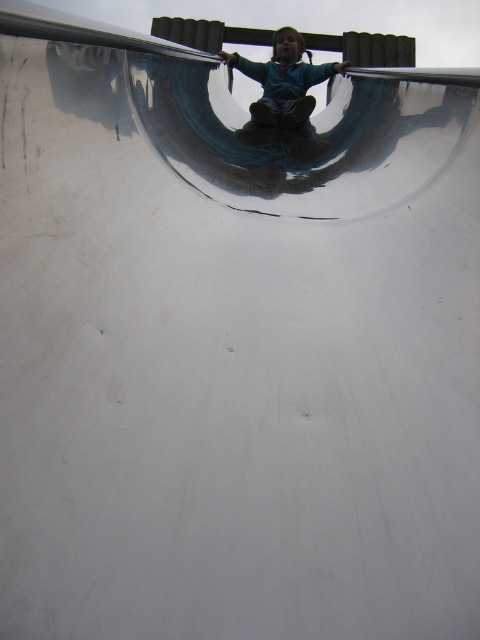
Question: Which point is closer to the camera?

Choices:
 (A) shiny blue skateboard at upper center
 (B) blue matte jacket at upper center

Answer: (A)

Question: Can you confirm if blue matte jacket at upper center is thinner than shiny blue skateboard at upper center?

Choices:
 (A) no
 (B) yes

Answer: (A)

Question: Can you confirm if blue matte jacket at upper center is smaller than shiny blue skateboard at upper center?

Choices:
 (A) no
 (B) yes

Answer: (A)

Question: Among these points, which one is nearest to the camera?

Choices:
 (A) (292, 36)
 (B) (302, 152)

Answer: (B)

Question: Can you confirm if blue matte jacket at upper center is positioned to the left of shiny blue skateboard at upper center?

Choices:
 (A) yes
 (B) no

Answer: (A)